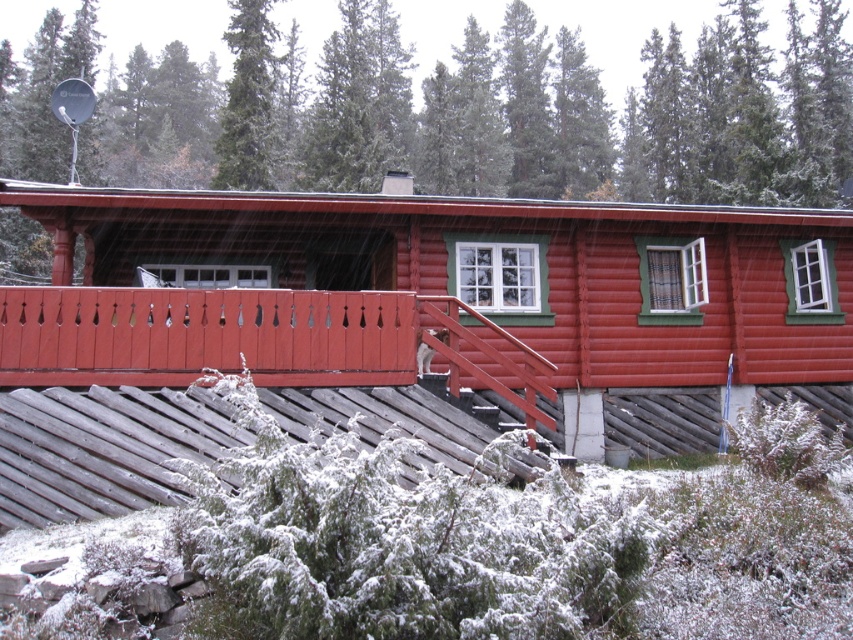
Can you confirm if matte wooden cabin at center is positioned above green coniferous tree at upper center?

No, matte wooden cabin at center is not above green coniferous tree at upper center.

Which is more to the right, matte wooden cabin at center or green coniferous tree at upper center?

green coniferous tree at upper center

You are a GUI agent. You are given a task and a screenshot of the screen. Output one action in this format:
    pyautogui.click(x=<x>, y=<y>)
    Task: Click on the matte wooden cabin at center
    The image size is (853, 640).
    Given the screenshot: What is the action you would take?
    pyautogui.click(x=433, y=291)